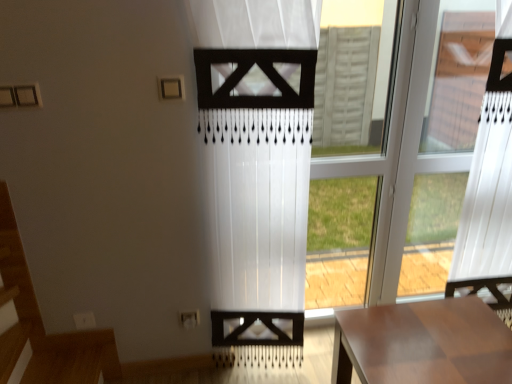
Question: Is wooden table at lower right inside or outside of transparent plastic window at right?

Choices:
 (A) inside
 (B) outside

Answer: (B)

Question: From a real-world perspective, is wooden table at lower right physically located above or below transparent plastic window at right?

Choices:
 (A) below
 (B) above

Answer: (A)

Question: Estimate the real-world distances between objects in this image. Which object is farther from the wooden table at lower right?

Choices:
 (A) transparent glass window at center
 (B) transparent plastic window at right
 (C) white sheer curtain at center

Answer: (A)

Question: Which object is positioned farthest from the transparent plastic window at right?

Choices:
 (A) white sheer curtain at center
 (B) transparent glass window at center
 (C) wooden table at lower right

Answer: (C)